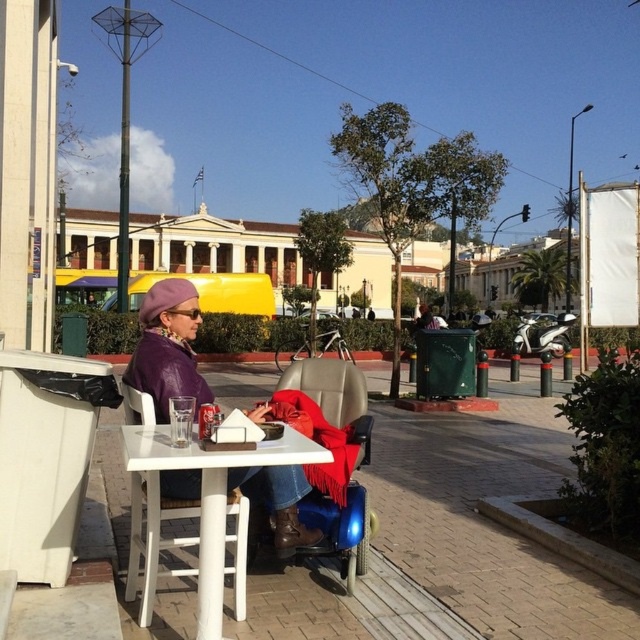
Is purple leather jacket at center shorter than white plastic table at center?

Incorrect, purple leather jacket at center's height does not fall short of white plastic table at center's.

You are a GUI agent. You are given a task and a screenshot of the screen. Output one action in this format:
    pyautogui.click(x=<x>, y=<y>)
    Task: Click on the purple leather jacket at center
    
    Given the screenshot: What is the action you would take?
    pyautogui.click(x=168, y=348)

Image resolution: width=640 pixels, height=640 pixels. I want to click on purple leather jacket at center, so click(x=168, y=348).